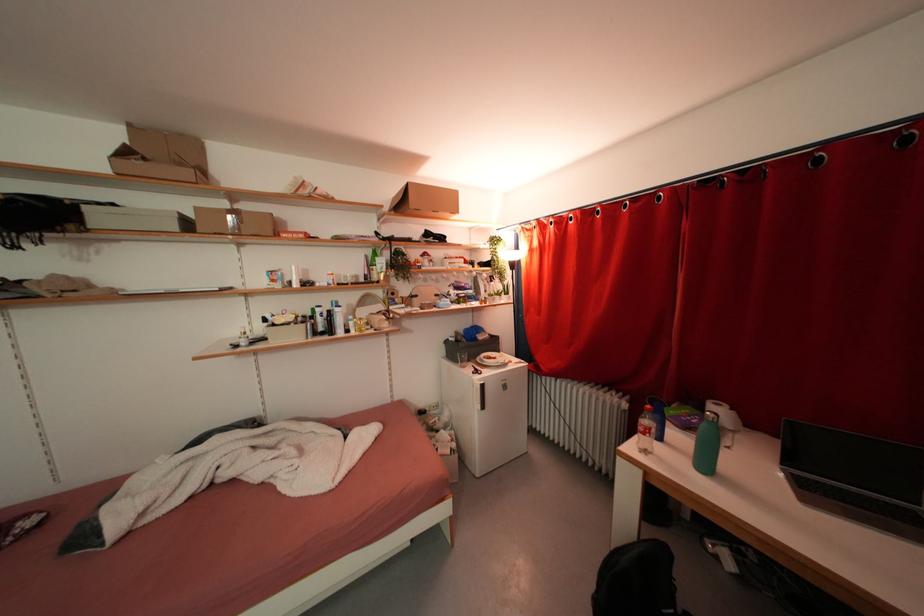
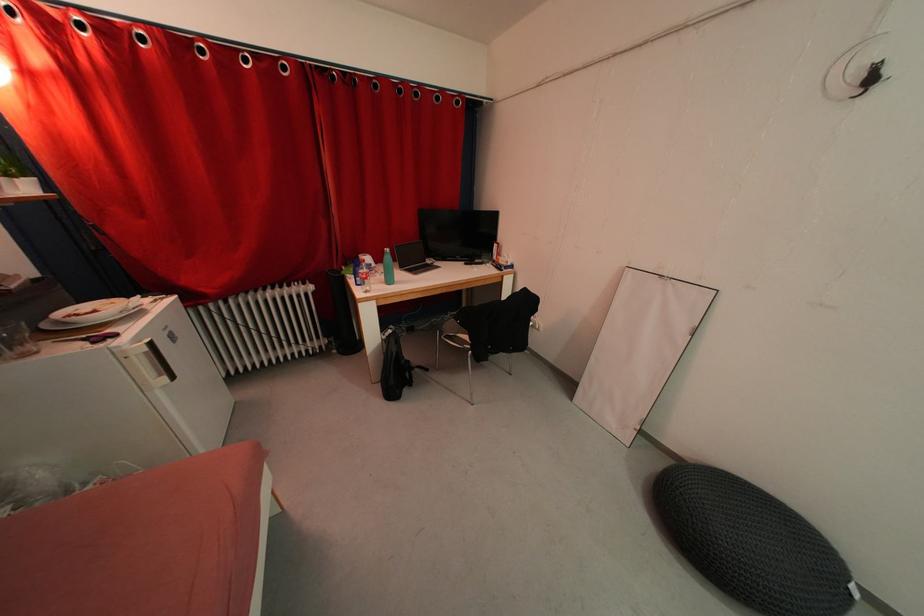
How did the camera likely rotate?

The camera rotated toward right-down.